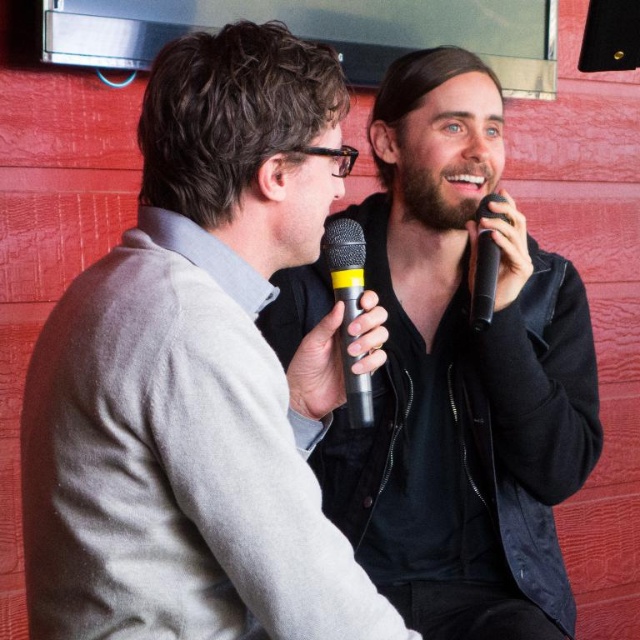
Is gray wool sweater at left wider than black matte microphone at right?

Correct, the width of gray wool sweater at left exceeds that of black matte microphone at right.

Looking at this image, is gray wool sweater at left above black matte microphone at right?

No, gray wool sweater at left is not above black matte microphone at right.

What do you see at coordinates (198, 376) in the screenshot? I see `gray wool sweater at left` at bounding box center [198, 376].

At what (x,y) coordinates should I click in order to perform the action: click on gray wool sweater at left. Please return your answer as a coordinate pair (x, y). This screenshot has height=640, width=640. Looking at the image, I should click on (198, 376).

Between gray wool sweater at left and black rubber microphone at center, which one appears on the right side from the viewer's perspective?

→ Positioned to the right is black rubber microphone at center.

Does gray wool sweater at left have a greater height compared to black rubber microphone at center?

Correct, gray wool sweater at left is much taller as black rubber microphone at center.

Identify the location of gray wool sweater at left. (198, 376).

The width and height of the screenshot is (640, 640). What are the coordinates of `gray wool sweater at left` in the screenshot? It's located at (198, 376).

Who is lower down, matte black jacket at center or black rubber microphone at center?

Positioned lower is matte black jacket at center.

Is point (534, 273) farther from camera compared to point (353, 312)?

Yes, it is.

Is point (435, 112) farther from camera compared to point (358, 280)?

Yes, point (435, 112) is behind point (358, 280).

Find the location of a particular element. matte black jacket at center is located at coordinates (461, 378).